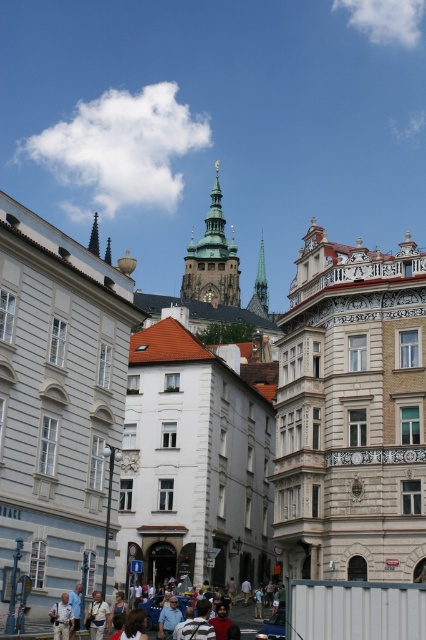
Question: Does white stone buildings at center appear under dark green stone spire at upper center?

Choices:
 (A) yes
 (B) no

Answer: (A)

Question: Is gold-plated spire at center smaller than light brown leather jacket at lower center?

Choices:
 (A) no
 (B) yes

Answer: (A)

Question: Which point is farther to the camera?

Choices:
 (A) gold-plated spire at center
 (B) white stone buildings at center
 (C) light brown leather jacket at lower center
 (D) dark green stone spire at upper center

Answer: (A)

Question: Which point appears closest to the camera in this image?

Choices:
 (A) (207, 296)
 (B) (160, 596)
 (C) (98, 248)

Answer: (B)

Question: Considering the relative positions of white stone buildings at center and light brown leather jacket at lower center in the image provided, where is white stone buildings at center located with respect to light brown leather jacket at lower center?

Choices:
 (A) left
 (B) right

Answer: (A)

Question: Considering the real-world distances, which object is farthest from the light brown leather jacket at lower center?

Choices:
 (A) gold-plated spire at center
 (B) dark green stone spire at upper center

Answer: (A)